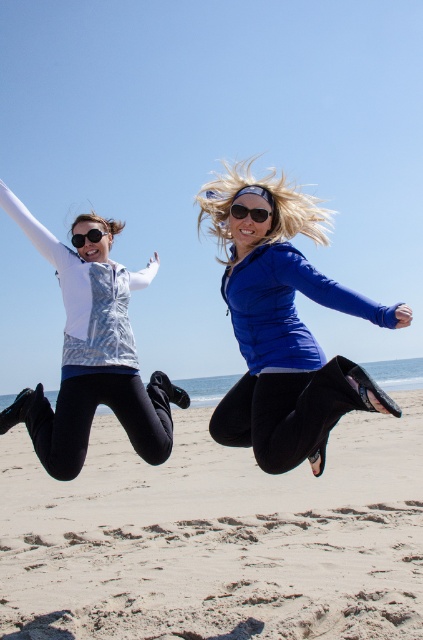
Question: Considering the real-world distances, which object is closest to the blue matte jacket at center?

Choices:
 (A) metallic silver vest at left
 (B) matte black sunglasses at upper left
 (C) black plastic sunglasses at center
 (D) sandy beach at lower center

Answer: (C)

Question: Which point is closer to the camera?

Choices:
 (A) (397, 496)
 (B) (233, 204)
 (C) (73, 236)

Answer: (B)

Question: Does blue matte jacket at center have a smaller size compared to matte black sunglasses at upper left?

Choices:
 (A) yes
 (B) no

Answer: (B)

Question: Estimate the real-world distances between objects in this image. Which object is closer to the black plastic sunglasses at center?

Choices:
 (A) matte black sunglasses at upper left
 (B) metallic silver vest at left

Answer: (A)

Question: Does blue matte jacket at center have a lesser width compared to black plastic sunglasses at center?

Choices:
 (A) no
 (B) yes

Answer: (A)

Question: Does sandy beach at lower center have a smaller size compared to black plastic sunglasses at center?

Choices:
 (A) no
 (B) yes

Answer: (A)